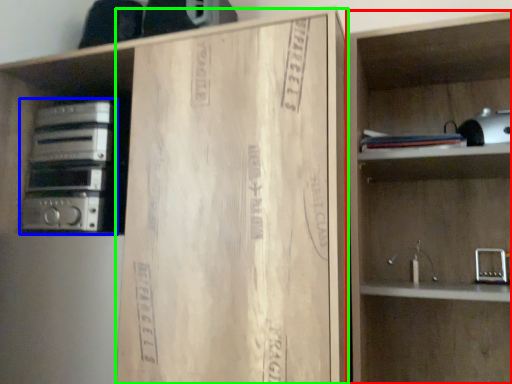
Question: Which is farther away from shelf (highlighted by a red box)? stereo (highlighted by a blue box) or cardboard (highlighted by a green box)?

Choices:
 (A) stereo
 (B) cardboard

Answer: (A)